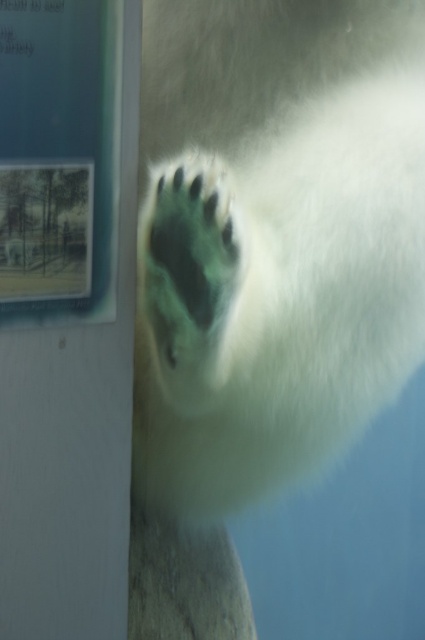
Question: Which object appears closest to the camera in this image?

Choices:
 (A) green fur paw at center
 (B) white fur paw at center

Answer: (A)

Question: Can you confirm if white fur paw at center is smaller than green fur paw at center?

Choices:
 (A) yes
 (B) no

Answer: (B)

Question: Is white fur paw at center in front of green fur paw at center?

Choices:
 (A) no
 (B) yes

Answer: (A)

Question: Can you confirm if white fur paw at center is bigger than green fur paw at center?

Choices:
 (A) no
 (B) yes

Answer: (B)

Question: Among these objects, which one is farthest from the camera?

Choices:
 (A) green fur paw at center
 (B) white fur paw at center

Answer: (B)